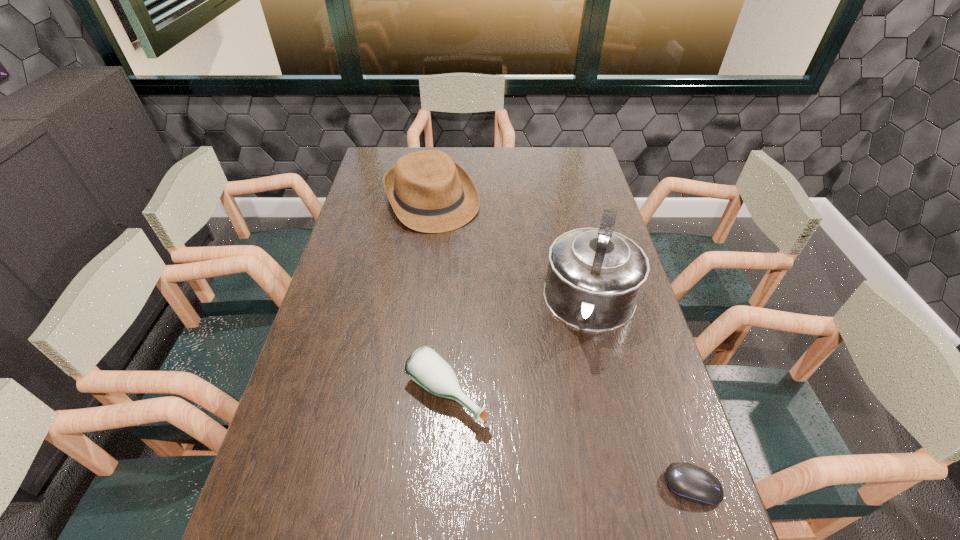
You are a GUI agent. You are given a task and a screenshot of the screen. Output one action in this format:
    pyautogui.click(x=<x>, y=<y>)
    Task: Click on the vacant space that is in between the fedora and the third tallest object
    The image size is (960, 540).
    Given the screenshot: What is the action you would take?
    pyautogui.click(x=440, y=298)

The height and width of the screenshot is (540, 960). In order to click on free space between the second tallest object and the third farthest object in this screenshot , I will do `click(440, 298)`.

Image resolution: width=960 pixels, height=540 pixels. Identify the location of free space that is in between the tallest object and the nearest object. (642, 396).

Image resolution: width=960 pixels, height=540 pixels. Find the location of `vacant region between the bottle and the fedora`. vacant region between the bottle and the fedora is located at coordinates (440, 298).

Where is `free space between the second tallest object and the shortest object`? Image resolution: width=960 pixels, height=540 pixels. free space between the second tallest object and the shortest object is located at coordinates (563, 343).

The height and width of the screenshot is (540, 960). Find the location of `free spot between the farthest object and the tallest object`. free spot between the farthest object and the tallest object is located at coordinates (512, 253).

I want to click on empty space that is in between the bottle and the second tallest object, so click(440, 298).

The width and height of the screenshot is (960, 540). I want to click on blank region between the kettle and the bottle, so click(x=519, y=350).

Choose which object is the nearest neighbor to the second shortest object. Please provide its 2D coordinates. Your answer should be formatted as a tuple, i.e. [(x, y)], where the tuple contains the x and y coordinates of a point satisfying the conditions above.

[(594, 278)]

Locate an element on the screen. the closest object to the shortest object is located at coordinates (594, 278).